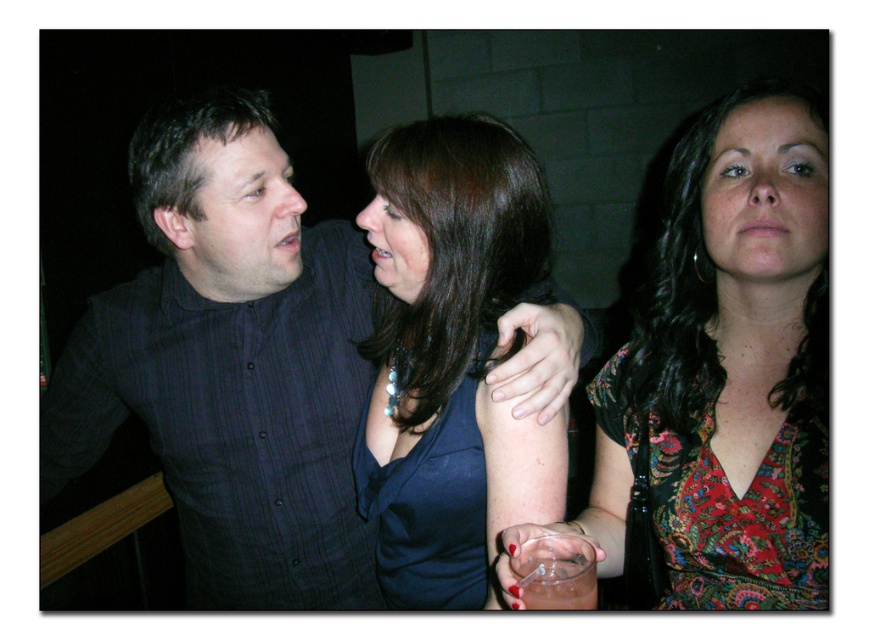
Is dark blue shirt at center to the left of floral dress at center from the viewer's perspective?

Yes, dark blue shirt at center is to the left of floral dress at center.

Does dark blue shirt at center have a lesser width compared to floral dress at center?

In fact, dark blue shirt at center might be wider than floral dress at center.

Where is `dark blue shirt at center`? Image resolution: width=869 pixels, height=640 pixels. dark blue shirt at center is located at coordinates click(x=231, y=364).

From the picture: Can you confirm if dark blue shirt at center is positioned to the left of shiny blue dress at center?

Correct, you'll find dark blue shirt at center to the left of shiny blue dress at center.

Is point (70, 369) closer to camera compared to point (453, 602)?

No.

Image resolution: width=869 pixels, height=640 pixels. What are the coordinates of `dark blue shirt at center` in the screenshot? It's located at point(231,364).

Can you confirm if shiny blue dress at center is positioned below clear glass at lower center?

No, shiny blue dress at center is not below clear glass at lower center.

Can you confirm if shiny blue dress at center is positioned to the left of clear glass at lower center?

Yes, shiny blue dress at center is to the left of clear glass at lower center.

Image resolution: width=869 pixels, height=640 pixels. What do you see at coordinates (450, 358) in the screenshot? I see `shiny blue dress at center` at bounding box center [450, 358].

Locate an element on the screen. The width and height of the screenshot is (869, 640). shiny blue dress at center is located at coordinates (450, 358).